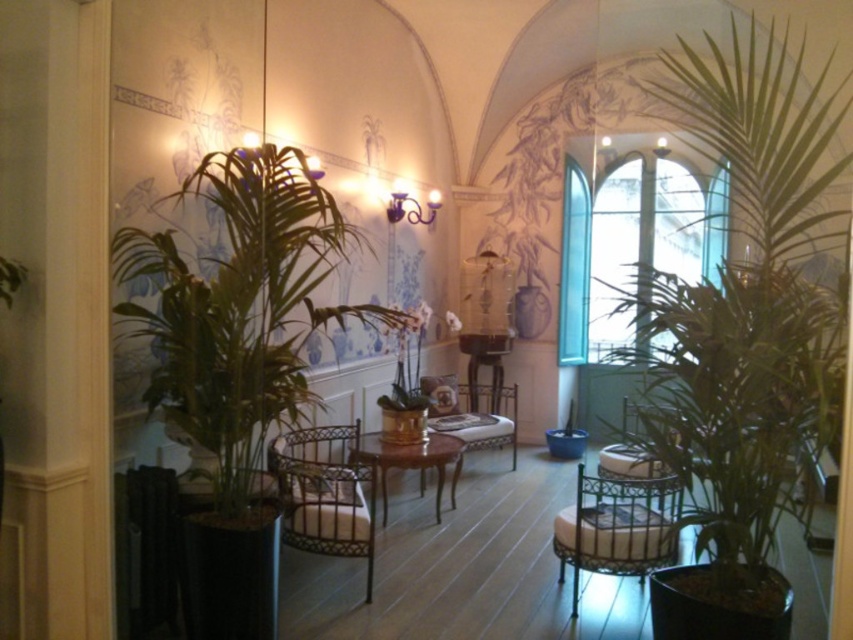
You are standing at the center of the room and want to move towards the green leafy plant at left. Which direction should you move in?

Since the green leafy plant at left is located at point 0.481 on the x and 0.284 on the y coordinate, you should move towards the left side of the room to reach it.

You are a guest entering the room and want to sit down. The metallic woven armchair at center is your target. However, there is a green leafy plant at left in the way. Can you walk around the plant to reach the chair without moving it?

The green leafy plant at left is in front of the metallic woven armchair at center, so you can walk around the plant to reach the chair without moving it since the plant is positioned in front and not blocking all pathways.